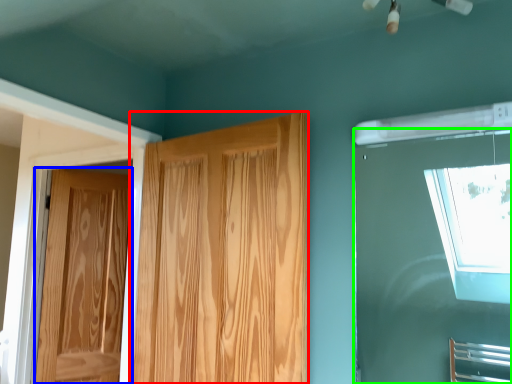
Question: Which is nearer to the door (highlighted by a red box)? door (highlighted by a blue box) or window (highlighted by a green box).

Choices:
 (A) door
 (B) window

Answer: (A)